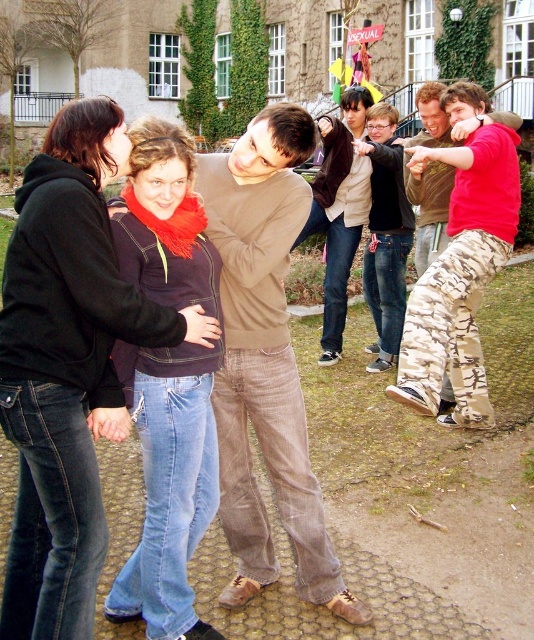
You are standing at the edge of the courtyard and see two people wearing brown corduroy pants at center and brown suede jacket at center. If you want to take a photo that includes both of them, how far apart should you position them from each other?

The brown corduroy pants at center is 5.32 meters away from brown suede jacket at center, so to include both in the photo, they should be positioned 5.32 meters apart from each other.

You are a photographer trying to capture a candid shot of the group. You notice the brown corduroy pants at center and the brown suede jacket at center. Which one is positioned lower in the frame?

The brown corduroy pants at center is located below brown suede jacket at center, so it is positioned lower in the frame.

You are a photographer trying to capture a candid shot of the denim jeans at left and camouflage pants at center. Since you want to ensure both are clearly visible, which one should you focus on first to account for their sizes?

The denim jeans at left is larger in size than camouflage pants at center, so you should focus on the denim jeans at left first to ensure clarity since it occupies more space in the frame.